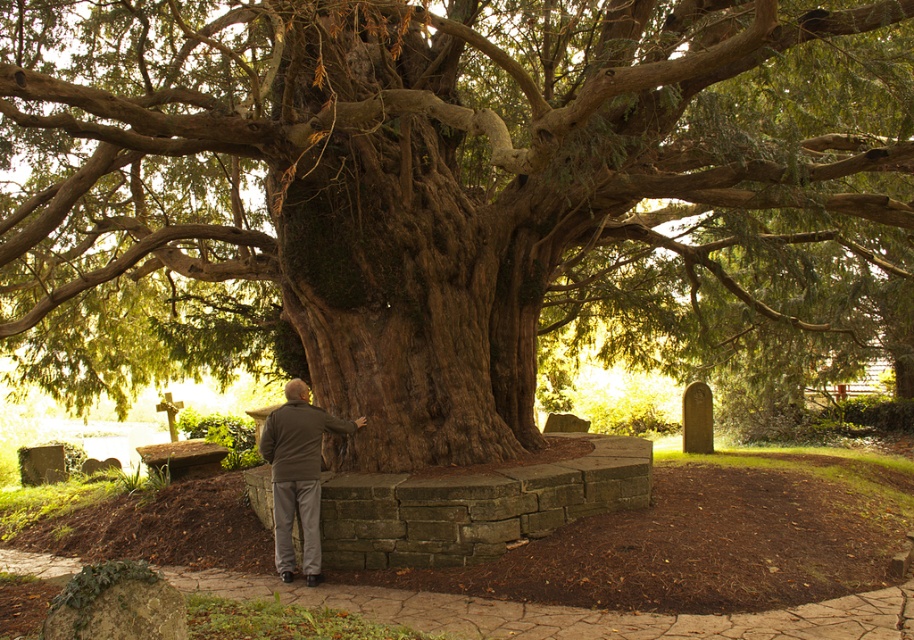
Question: Where is dark brown textured bark at center located in relation to dark gray jacket at center in the image?

Choices:
 (A) right
 (B) left

Answer: (A)

Question: Does dark brown textured bark at center appear over dark gray jacket at center?

Choices:
 (A) no
 (B) yes

Answer: (B)

Question: Does dark brown textured bark at center have a larger size compared to dark gray jacket at center?

Choices:
 (A) no
 (B) yes

Answer: (B)

Question: Which point is closer to the camera taking this photo?

Choices:
 (A) (283, 413)
 (B) (586, 253)

Answer: (A)